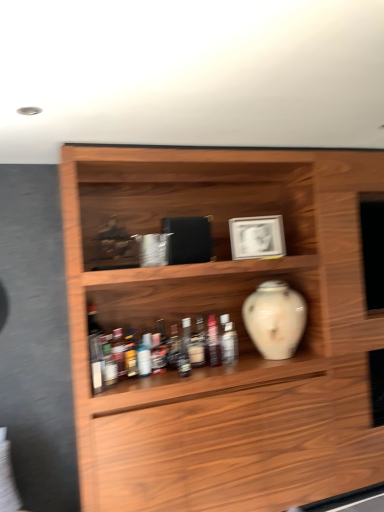
Question: Considering the relative positions of translucent plastic bottles at lower center, which is the third bottle from back to front, and translucent plastic bottle at center, acting as the second bottle starting from the front, in the image provided, is translucent plastic bottles at lower center, which is the third bottle from back to front, to the left of translucent plastic bottle at center, acting as the second bottle starting from the front, from the viewer's perspective?

Choices:
 (A) yes
 (B) no

Answer: (A)

Question: Is translucent plastic bottles at lower center, which is the third bottle from back to front, facing towards translucent plastic bottle at center, acting as the second bottle starting from the front?

Choices:
 (A) yes
 (B) no

Answer: (B)

Question: Is translucent plastic bottles at lower center, placed as the third bottle when sorted from right to left, not close to translucent plastic bottle at center, acting as the second bottle starting from the front?

Choices:
 (A) yes
 (B) no

Answer: (B)

Question: Is translucent plastic bottles at lower center, placed as the third bottle when sorted from right to left, closer to camera compared to translucent plastic bottle at center, acting as the second bottle starting from the front?

Choices:
 (A) yes
 (B) no

Answer: (A)

Question: Is translucent plastic bottles at lower center, placed as the third bottle when sorted from right to left, smaller than translucent plastic bottle at center, the third bottle when ordered from left to right?

Choices:
 (A) no
 (B) yes

Answer: (A)

Question: Is white glossy vase at center spatially inside translucent plastic bottle at center, the third bottle when ordered from left to right, or outside of it?

Choices:
 (A) inside
 (B) outside

Answer: (B)

Question: Is point (266, 291) closer or farther from the camera than point (236, 339)?

Choices:
 (A) farther
 (B) closer

Answer: (B)

Question: From the image's perspective, is white glossy vase at center above or below translucent plastic bottle at center, acting as the second bottle starting from the front?

Choices:
 (A) above
 (B) below

Answer: (A)

Question: In the image, is white glossy vase at center positioned in front of or behind translucent plastic bottle at center, acting as the second bottle starting from the front?

Choices:
 (A) behind
 (B) front

Answer: (B)

Question: Is translucent glass bottle at center, the 2th bottle viewed from the left, spatially inside wooden shelf at center, or outside of it?

Choices:
 (A) outside
 (B) inside

Answer: (B)

Question: Looking at the image, does translucent glass bottle at center, which is counted as the first bottle, starting from the back, seem bigger or smaller compared to wooden shelf at center?

Choices:
 (A) big
 (B) small

Answer: (B)

Question: Would you say translucent glass bottle at center, the third bottle positioned from the front, is to the left or to the right of wooden shelf at center in the picture?

Choices:
 (A) left
 (B) right

Answer: (A)

Question: From the image's perspective, is translucent glass bottle at center, which is counted as the first bottle, starting from the back, positioned above or below wooden shelf at center?

Choices:
 (A) above
 (B) below

Answer: (B)

Question: From their relative heights in the image, would you say translucent glass bottle at center, the 2th bottle viewed from the left, is taller or shorter than translucent plastic bottles at lower center, which is counted as the 1th bottle, starting from the front?

Choices:
 (A) tall
 (B) short

Answer: (A)

Question: Is translucent glass bottle at center, arranged as the second bottle when viewed from the right, bigger or smaller than translucent plastic bottles at lower center, which is the third bottle from back to front?

Choices:
 (A) small
 (B) big

Answer: (A)